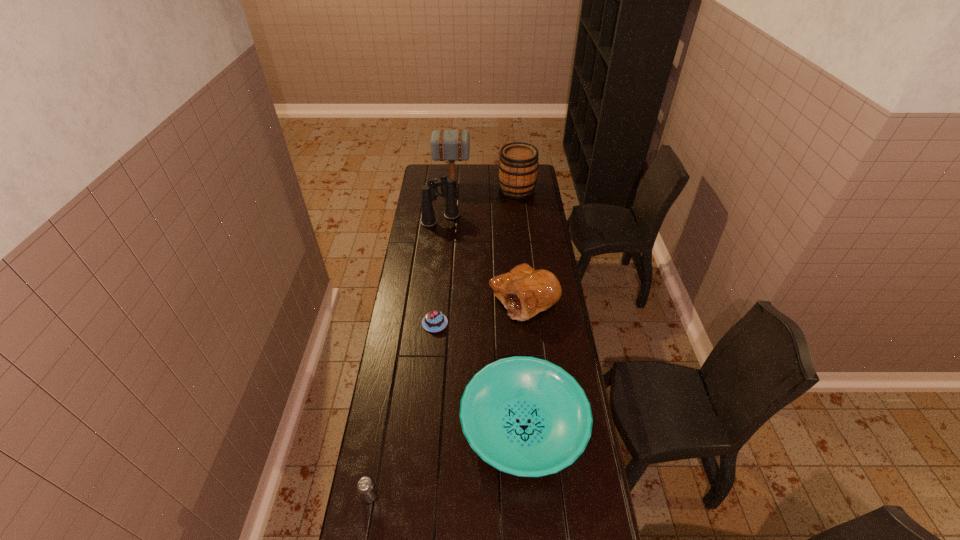
The height and width of the screenshot is (540, 960). In order to click on free space between the cider and the chocolate cake in this screenshot , I will do `click(476, 256)`.

This screenshot has width=960, height=540. What are the coordinates of `unoccupied area between the binoculars and the cider` in the screenshot? It's located at (479, 205).

This screenshot has height=540, width=960. Find the location of `free area in between the third farthest object and the shortest object`. free area in between the third farthest object and the shortest object is located at coordinates pyautogui.click(x=438, y=271).

Identify the location of object that is the fourth closest to the chocolate cake. tap(365, 486).

Where is `the fourth closest object relative to the dish`? the fourth closest object relative to the dish is located at coordinates (447, 187).

Identify the location of free space in the image that satisfies the following two spatial constraints: 1. on the back side of the cider; 2. on the right side of the dish. The width and height of the screenshot is (960, 540). (506, 190).

Where is `free spot that satisfies the following two spatial constraints: 1. on the striking surface of the tallest object; 2. on the back side of the dish`? free spot that satisfies the following two spatial constraints: 1. on the striking surface of the tallest object; 2. on the back side of the dish is located at coordinates (433, 425).